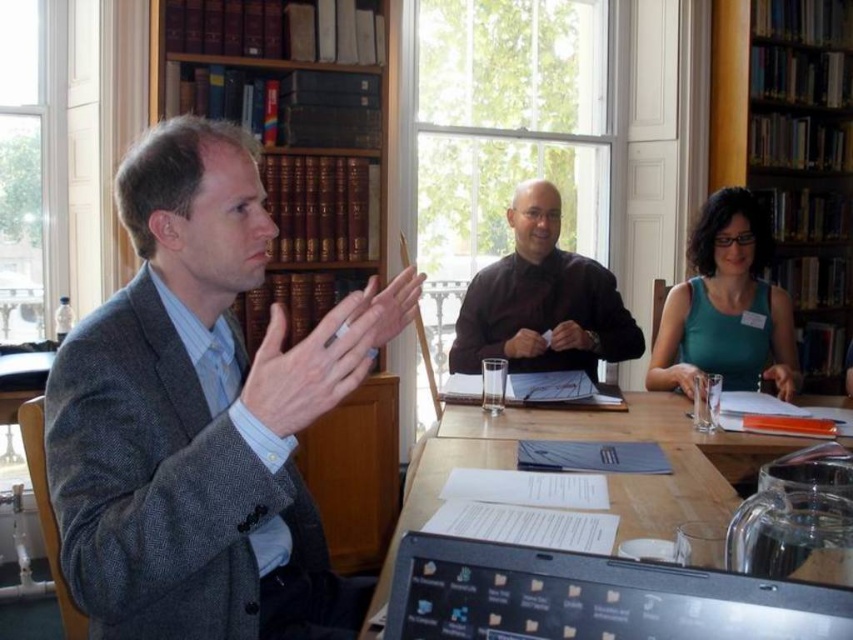
Question: Which is nearer to the black glossy laptop at lower center?

Choices:
 (A) wooden table at center
 (B) wooden bookshelf at upper right

Answer: (A)

Question: Is black glossy laptop at lower center below wooden table at center?

Choices:
 (A) no
 (B) yes

Answer: (A)

Question: Is gray woolen suit at left further to camera compared to wooden table at center?

Choices:
 (A) no
 (B) yes

Answer: (A)

Question: Among these points, which one is nearest to the camera?

Choices:
 (A) (509, 300)
 (B) (463, 541)
 (C) (763, 163)
 (D) (680, 296)

Answer: (B)

Question: Is wooden table at center wider than black matte shirt at center?

Choices:
 (A) no
 (B) yes

Answer: (B)

Question: Which point is closer to the camera?

Choices:
 (A) (457, 330)
 (B) (460, 428)

Answer: (B)